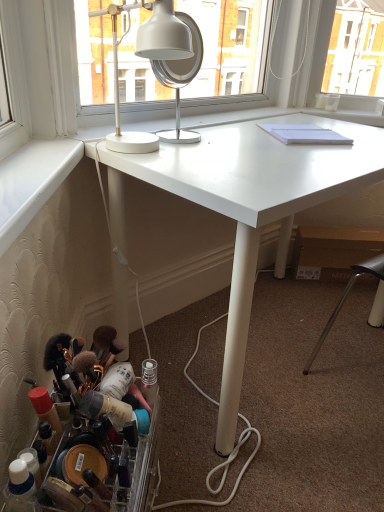
Where is `empty space that is to the right of white glossy desk lamp at upper center`? This screenshot has width=384, height=512. empty space that is to the right of white glossy desk lamp at upper center is located at coordinates (217, 154).